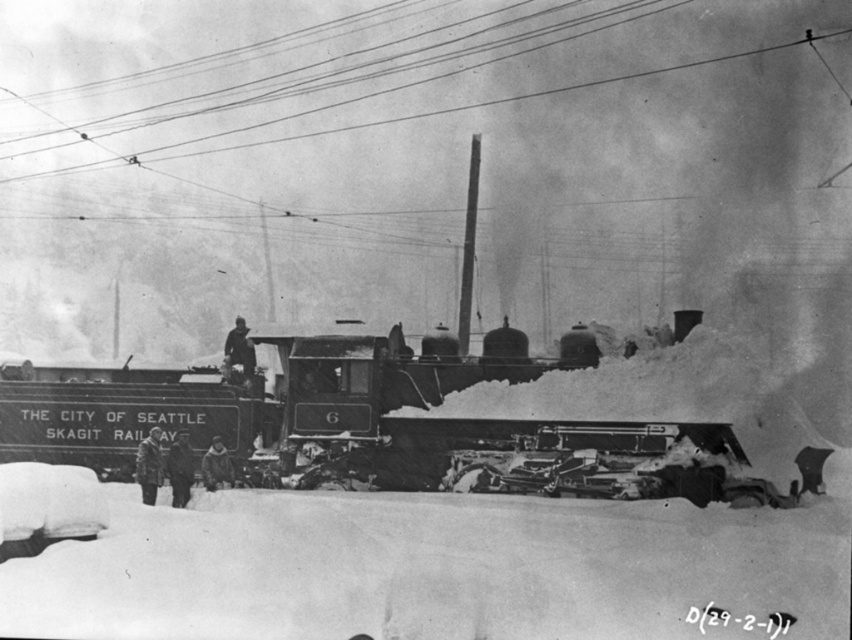
You are a railway engineer trying to assess the position of the train. According to the coordinate system where the bottom left corner is the origin, what are the coordinates of the polished steel train at center?

The coordinates of the polished steel train at center are at point (363, 426).

You are a photographer trying to capture the scene of the polished steel train at center and the smooth wire at upper center. Based on their sizes, which object would appear closer to the camera lens?

The polished steel train at center has a smaller size compared to smooth wire at upper center, so the smooth wire at upper center appears closer to the camera lens because larger objects in the foreground can appear bigger than smaller ones in the background.